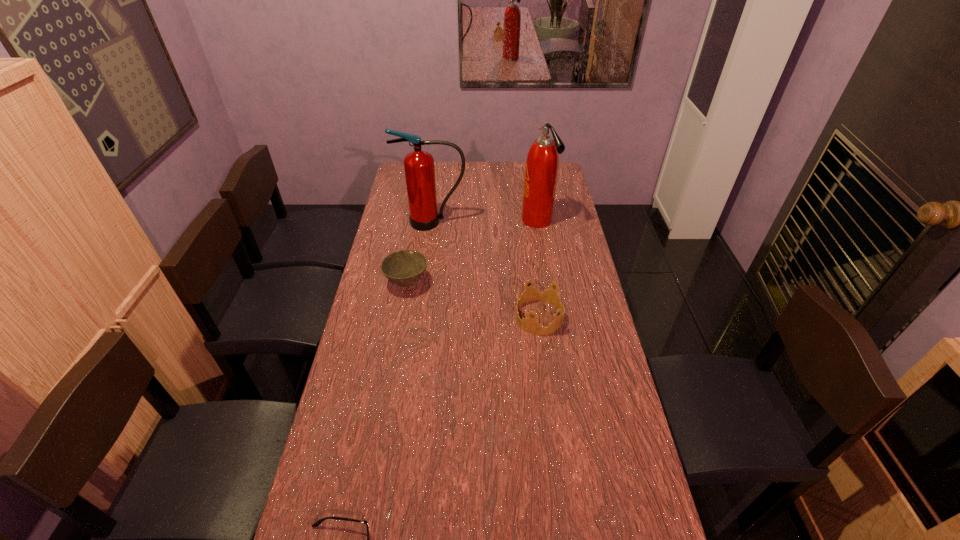
The image size is (960, 540). I want to click on the right fire extinguisher, so click(x=541, y=169).

Identify the location of the left fire extinguisher. The width and height of the screenshot is (960, 540). (419, 168).

You are a GUI agent. You are given a task and a screenshot of the screen. Output one action in this format:
    pyautogui.click(x=<x>, y=<y>)
    Task: Click on the tiara
    The image size is (960, 540).
    Given the screenshot: What is the action you would take?
    pyautogui.click(x=530, y=325)

Identify the location of the third farthest object. (404, 268).

The height and width of the screenshot is (540, 960). What are the coordinates of `vacant region located 0.070m on the back of the right fire extinguisher` in the screenshot? It's located at (534, 200).

Locate an element on the screen. vacant region located 0.060m on the right of the left fire extinguisher is located at coordinates (480, 222).

Locate an element on the screen. free location located 0.350m on the front-facing side of the tiara is located at coordinates (416, 317).

You are a GUI agent. You are given a task and a screenshot of the screen. Output one action in this format:
    pyautogui.click(x=<x>, y=<y>)
    Task: Click on the free space located 0.110m on the front-facing side of the tiara
    This screenshot has height=540, width=960.
    Given the screenshot: What is the action you would take?
    click(484, 317)

Find the location of a particular element. This screenshot has height=540, width=960. free space located on the front-facing side of the tiara is located at coordinates (475, 317).

This screenshot has width=960, height=540. I want to click on free space located on the right of the third nearest object, so click(487, 283).